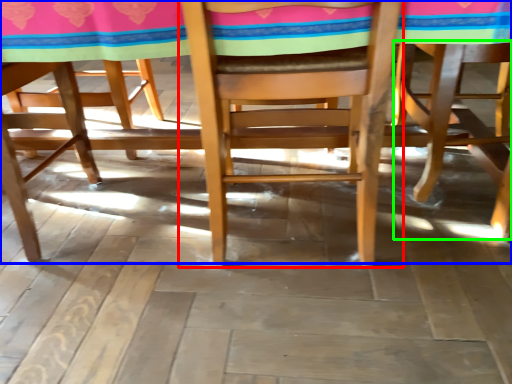
Question: Estimate the real-world distances between objects in this image. Which object is closer to chair (highlighted by a red box), table (highlighted by a blue box) or chair (highlighted by a green box)?

Choices:
 (A) table
 (B) chair

Answer: (A)